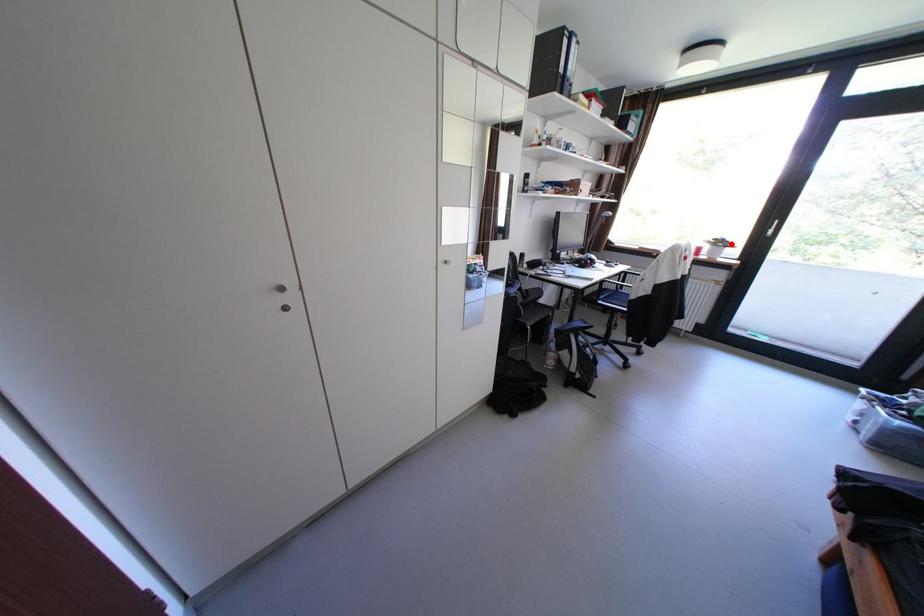
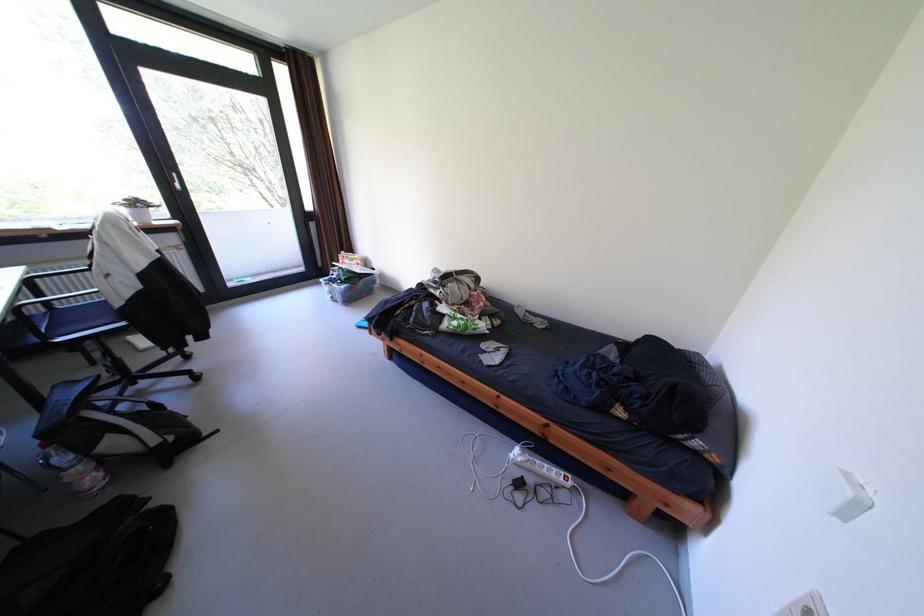
Where in the second image is the point corresponding to the highlighted location from the first image?

(149, 205)